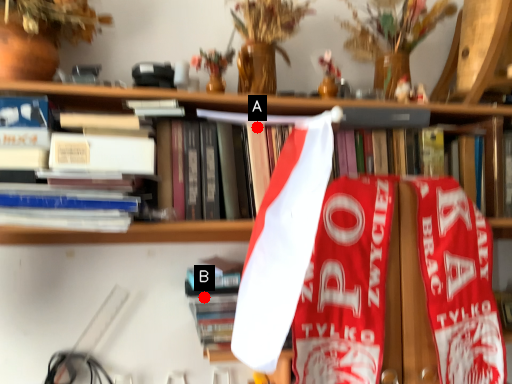
Question: Two points are circled on the image, labeled by A and B beside each circle. Which point is closer to the camera?

Choices:
 (A) A is closer
 (B) B is closer

Answer: (B)